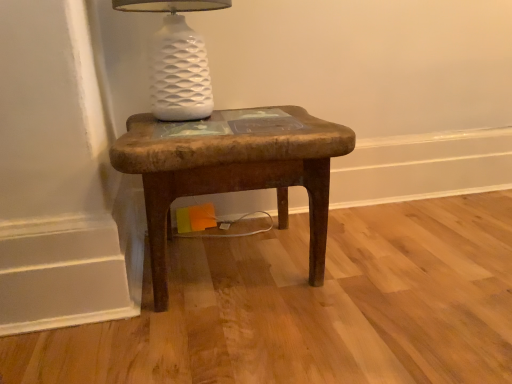
At what (x,y) coordinates should I click in order to perform the action: click on blank space above rustic wood stool at center (from a real-world perspective). Please return your answer as a coordinate pair (x, y). The width and height of the screenshot is (512, 384). Looking at the image, I should click on (232, 124).